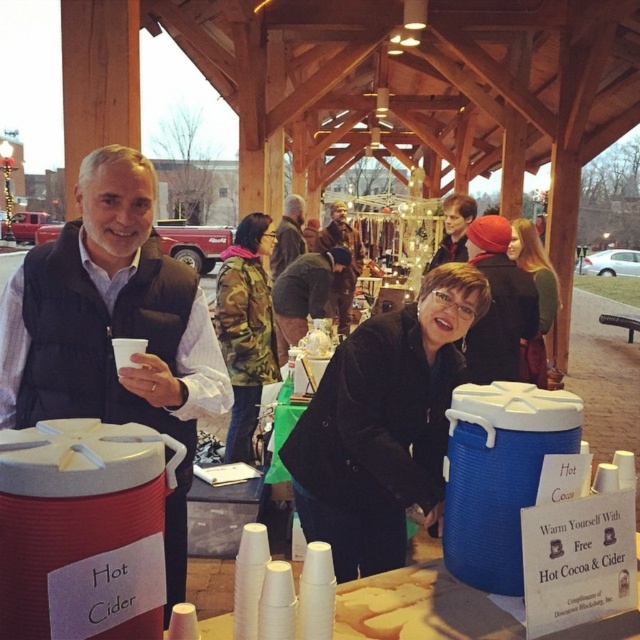
You are at a community event and see two people at the table. One is wearing a matte black jacket at center and the other a brown leather jacket at center. Which person is standing to the right of the other?

The matte black jacket at center is positioned on the right side of brown leather jacket at center, so the person in the matte black jacket at center is standing to the right of the person in the brown leather jacket at center.

You are a photographer trying to capture a candid shot of both the black matte jacket at center and the matte black jacket at center. Given that your camera has a minimum focus distance of 12 inches, will you need to step back to ensure both are in focus?

The black matte jacket at center and the matte black jacket at center are 11.27 inches apart from each other. Since the distance between them is less than the camera minimum focus distance of 12 inches, you will need to step back to ensure both are in focus.

Looking at this image, you are organizing a photo shoot and need to decide which of the two coats, the brown fuzzy coat at center or the brown leather jacket at center, will look better in a closeup shot. Considering their sizes, which one would you choose?

The brown fuzzy coat at center has a larger size compared to the brown leather jacket at center, so it would be more suitable for a closeup shot as its larger size allows for more detailed features to be captured.